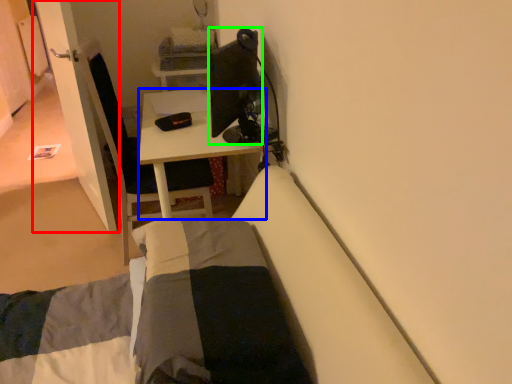
Question: Based on their relative distances, which object is nearer to door (highlighted by a red box)? Choose from desk (highlighted by a blue box) and television (highlighted by a green box).

Choices:
 (A) desk
 (B) television

Answer: (A)